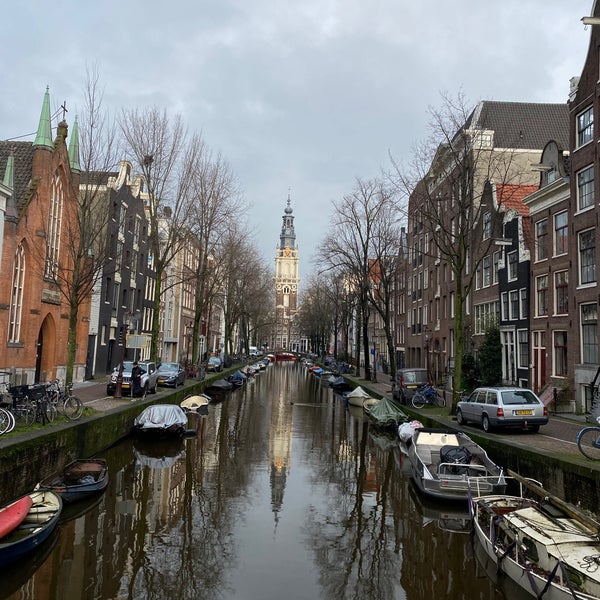
You are a GUI agent. You are given a task and a screenshot of the screen. Output one action in this format:
    pyautogui.click(x=<x>, y=<y>)
    Task: Click on the archway
    Image resolution: width=600 pixels, height=600 pixels.
    Given the screenshot: What is the action you would take?
    pyautogui.click(x=45, y=350)